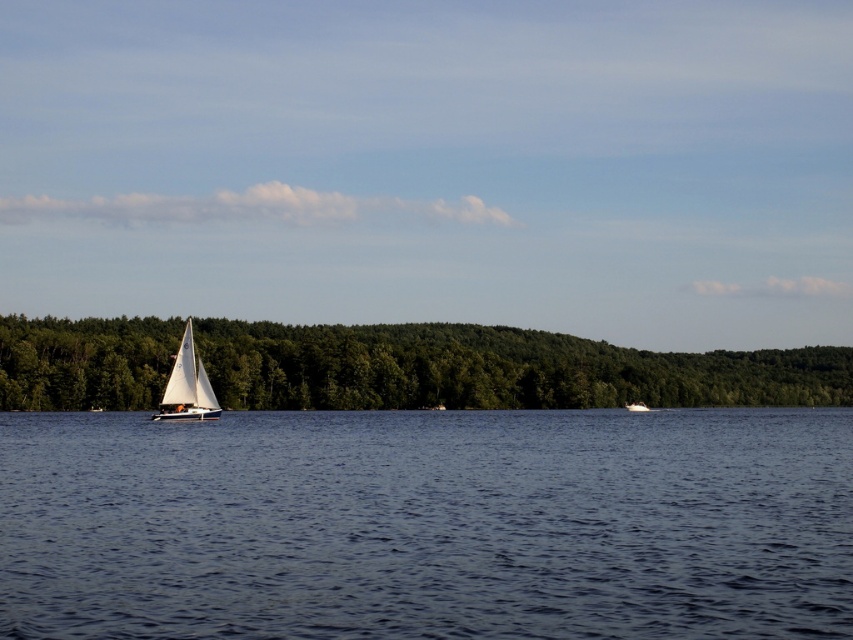
Can you confirm if white sailboat at left is smaller than white glossy boat at center?

Correct, white sailboat at left occupies less space than white glossy boat at center.

Is white sailboat at left wider than white glossy boat at center?

No, white sailboat at left is not wider than white glossy boat at center.

Is point (189, 358) less distant than point (630, 406)?

Yes, point (189, 358) is closer to viewer.

This screenshot has height=640, width=853. In order to click on white sailboat at left in this screenshot , I will do `click(187, 387)`.

Which is in front, point (506, 513) or point (643, 406)?

Positioned in front is point (506, 513).

Describe the element at coordinates (428, 524) in the screenshot. I see `blue water at center` at that location.

Does point (138, 572) lie behind point (630, 403)?

No, (138, 572) is closer to viewer.

Where is `blue water at center`? blue water at center is located at coordinates [428, 524].

Can you confirm if green leafy trees at left is shorter than white glossy boat at center?

No.

At what (x,y) coordinates should I click in order to perform the action: click on green leafy trees at left. Please return your answer as a coordinate pair (x, y). This screenshot has width=853, height=640. Looking at the image, I should click on (495, 369).